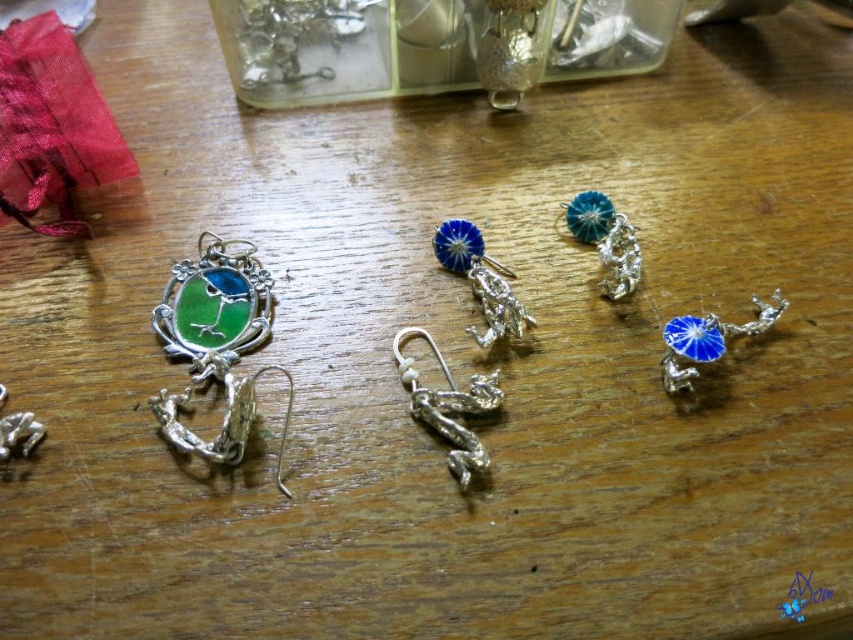
Between silver metallic hook at center and blue enamel charm at right, which one is positioned higher?

blue enamel charm at right

How distant is silver metallic hook at center from blue enamel charm at right?

The distance of silver metallic hook at center from blue enamel charm at right is 12.29 inches.

What do you see at coordinates (448, 404) in the screenshot? I see `silver metallic hook at center` at bounding box center [448, 404].

Image resolution: width=853 pixels, height=640 pixels. What are the coordinates of `silver metallic hook at center` in the screenshot? It's located at (448, 404).